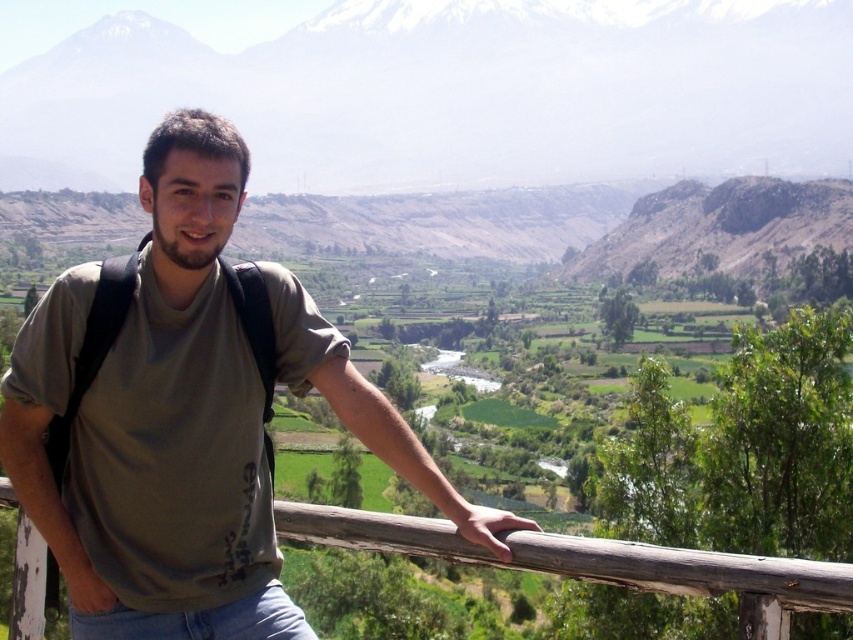
The image size is (853, 640). What do you see at coordinates (155, 422) in the screenshot?
I see `matte green t-shirt at center` at bounding box center [155, 422].

How distant is matte green t-shirt at center from brown wooden rail at center?

They are 7.05 meters apart.

Is point (190, 173) less distant than point (15, 618)?

Yes, point (190, 173) is closer to viewer.

Locate an element on the screen. This screenshot has width=853, height=640. matte green t-shirt at center is located at coordinates (155, 422).